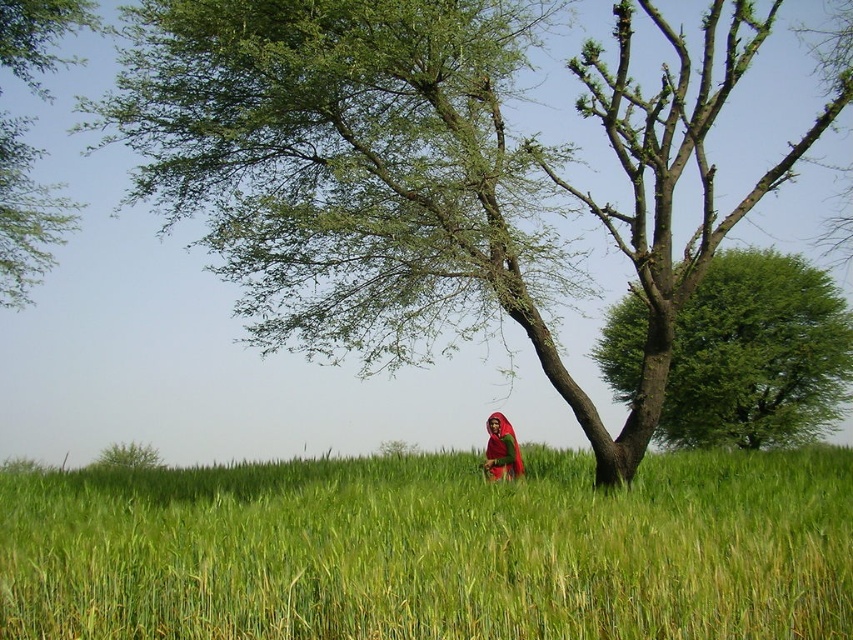
Can you confirm if green leafy tree at center is positioned to the left of matte red sari at center?

Incorrect, green leafy tree at center is not on the left side of matte red sari at center.

Between green leafy tree at center and matte red sari at center, which one has less height?

green leafy tree at center

You are a GUI agent. You are given a task and a screenshot of the screen. Output one action in this format:
    pyautogui.click(x=<x>, y=<y>)
    Task: Click on the green leafy tree at center
    This screenshot has height=640, width=853.
    Given the screenshot: What is the action you would take?
    pyautogui.click(x=419, y=172)

Which of these two, green grassy field at center or green leafy tree at upper left, stands shorter?

With less height is green grassy field at center.

Is point (468, 592) positioned before point (25, 1)?

Yes, it is.

Is point (640, 536) positioned before point (6, 177)?

Yes, it is in front of point (6, 177).

The height and width of the screenshot is (640, 853). I want to click on green grassy field at center, so click(x=433, y=548).

Does green grassy field at center have a greater width compared to matte red sari at center?

Correct, the width of green grassy field at center exceeds that of matte red sari at center.

Who is higher up, green grassy field at center or matte red sari at center?

matte red sari at center is higher up.

Does point (412, 588) lie in front of point (515, 456)?

Yes, it is in front of point (515, 456).

At what (x,y) coordinates should I click in order to perform the action: click on green grassy field at center. Please return your answer as a coordinate pair (x, y). The width and height of the screenshot is (853, 640). Looking at the image, I should click on (433, 548).